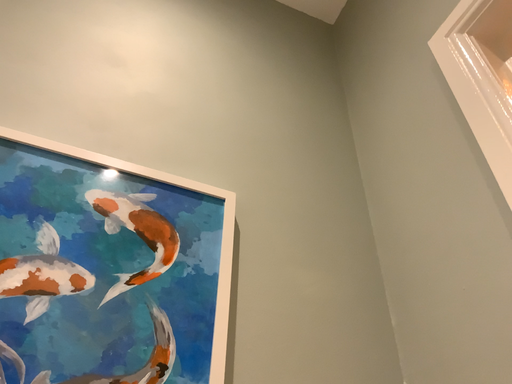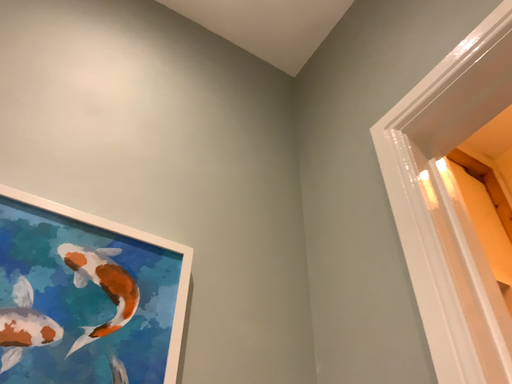
Question: How did the camera likely rotate when shooting the video?

Choices:
 (A) rotated left
 (B) rotated right

Answer: (B)